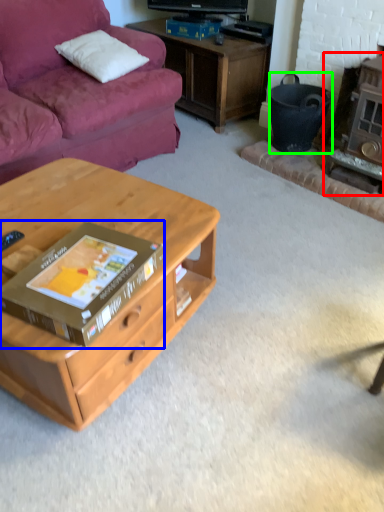
Question: Estimate the real-world distances between objects in this image. Which object is farther from fireplace (highlighted by a red box), box (highlighted by a blue box) or trash bin/can (highlighted by a green box)?

Choices:
 (A) box
 (B) trash bin/can

Answer: (A)